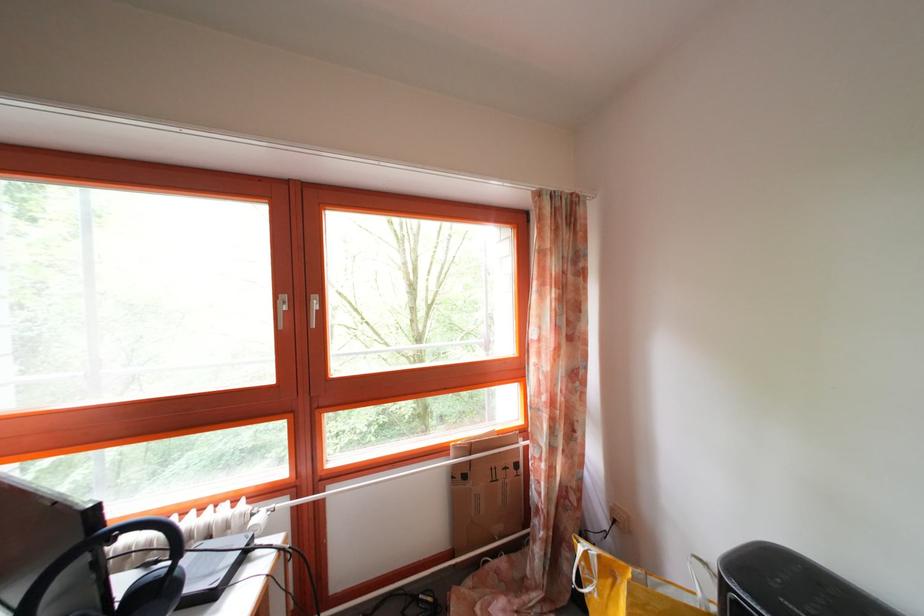
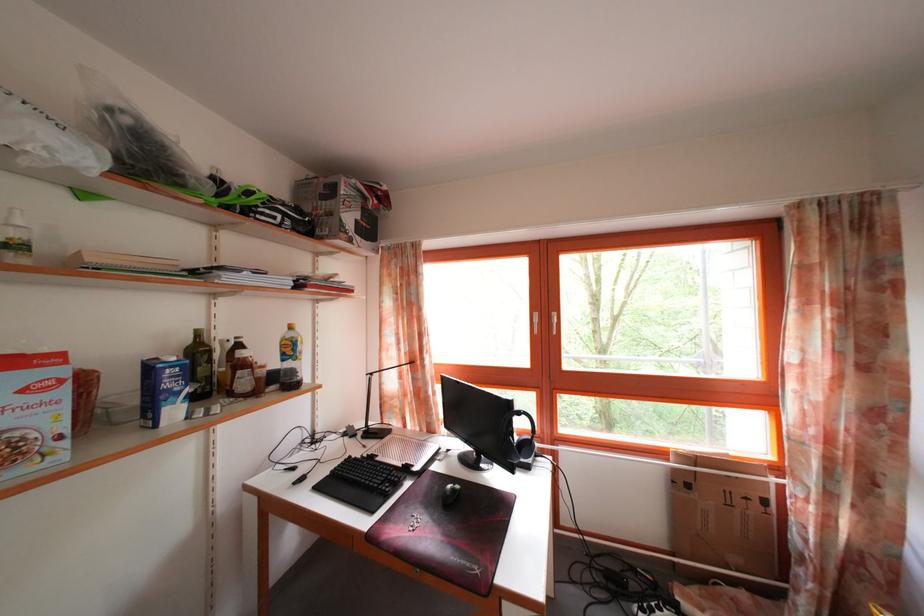
Question: Based on the continuous images, in which direction is the camera rotating? Reply with the corresponding letter.

Choices:
 (A) Left
 (B) Right
 (C) Up
 (D) Down

Answer: (A)